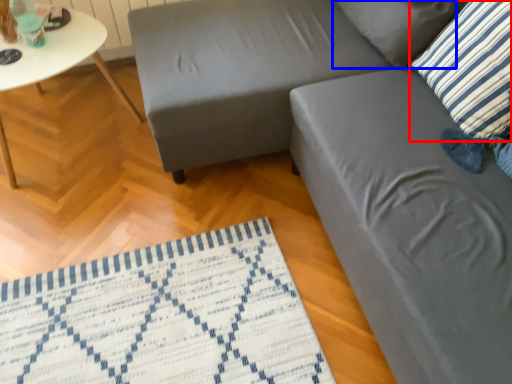
Question: Among these objects, which one is farthest to the camera, pillow (highlighted by a red box) or pillow (highlighted by a blue box)?

Choices:
 (A) pillow
 (B) pillow

Answer: (B)